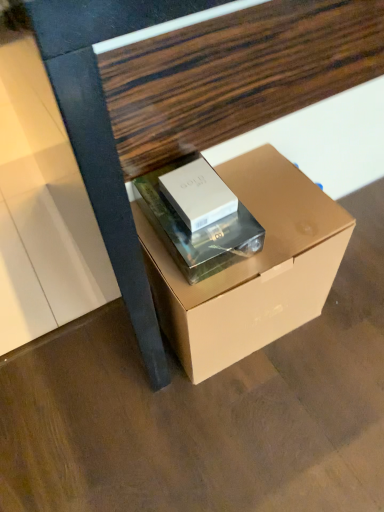
Describe the element at coordinates (187, 97) in the screenshot. I see `matte cardboard box at center` at that location.

Describe the element at coordinates (198, 230) in the screenshot. This screenshot has height=512, width=384. I see `matte white book at center` at that location.

Describe the element at coordinates (248, 267) in the screenshot. I see `matte cardboard box at center, arranged as the first box when viewed from the right` at that location.

In order to click on matte cardboard box at center in this screenshot , I will do `click(187, 97)`.

Between matte cardboard box at center, which appears as the 2th box when viewed from the left, and matte white book at center, which one is positioned in front?

matte cardboard box at center, which appears as the 2th box when viewed from the left, is in front.

Is matte cardboard box at center, which appears as the 2th box when viewed from the left, located outside matte white book at center?

Absolutely, matte cardboard box at center, which appears as the 2th box when viewed from the left, is external to matte white book at center.

Based on the photo, how different are the orientations of matte cardboard box at center, arranged as the first box when viewed from the right, and matte white book at center in degrees?

The facing directions of matte cardboard box at center, arranged as the first box when viewed from the right, and matte white book at center are 0.000742 degrees apart.

Is matte cardboard box at center, arranged as the first box when viewed from the right, at the right side of matte white book at center?

Yes, matte cardboard box at center, arranged as the first box when viewed from the right, is to the right of matte white book at center.

From a real-world perspective, between matte white book at center and matte cardboard box at center, arranged as the first box when viewed from the right, who is vertically lower?

In real-world perspective, matte cardboard box at center, arranged as the first box when viewed from the right, is lower.

From the image's perspective, between matte white book at center and matte cardboard box at center, which appears as the 2th box when viewed from the left, who is located below?

From the image's view, matte cardboard box at center, which appears as the 2th box when viewed from the left, is below.

Is matte white book at center outside of matte cardboard box at center, which appears as the 2th box when viewed from the left?

No, matte white book at center is inside or overlapping with matte cardboard box at center, which appears as the 2th box when viewed from the left.

Which is closer to the camera, (178, 167) or (290, 173)?

Positioned in front is point (178, 167).

From the image's perspective, which one is positioned lower, silver metallic box at center, which is the second box from right to left, or matte cardboard box at center?

silver metallic box at center, which is the second box from right to left.

You are a GUI agent. You are given a task and a screenshot of the screen. Output one action in this format:
    pyautogui.click(x=<x>, y=<y>)
    Task: Click on the furniture on the right of silver metallic box at center, which is the second box from right to left
    This screenshot has height=512, width=384.
    Given the screenshot: What is the action you would take?
    pyautogui.click(x=187, y=97)

Considering the relative sizes of silver metallic box at center, acting as the first box starting from the left, and matte cardboard box at center in the image provided, is silver metallic box at center, acting as the first box starting from the left, thinner than matte cardboard box at center?

Yes.

Can you confirm if silver metallic box at center, acting as the first box starting from the left, is shorter than matte cardboard box at center, which appears as the 2th box when viewed from the left?

Yes, silver metallic box at center, acting as the first box starting from the left, is shorter than matte cardboard box at center, which appears as the 2th box when viewed from the left.

Which point is more forward, (194, 208) or (251, 190)?

The point (194, 208) is more forward.

Considering the positions of objects silver metallic box at center, which is the second box from right to left, and matte cardboard box at center, arranged as the first box when viewed from the right, in the image provided, who is in front, silver metallic box at center, which is the second box from right to left, or matte cardboard box at center, arranged as the first box when viewed from the right,?

matte cardboard box at center, arranged as the first box when viewed from the right, is closer to the camera.

Would you say silver metallic box at center, which is the second box from right to left, is to the left or to the right of matte cardboard box at center, which appears as the 2th box when viewed from the left, in the picture?

In the image, silver metallic box at center, which is the second box from right to left, appears on the left side of matte cardboard box at center, which appears as the 2th box when viewed from the left.

Locate an element on the screen. box in front of the silver metallic box at center, acting as the first box starting from the left is located at coordinates (248, 267).

Choose the correct answer: Is matte cardboard box at center, arranged as the first box when viewed from the right, inside silver metallic box at center, acting as the first box starting from the left, or outside it?

The correct answer is: outside.

From a real-world perspective, relative to silver metallic box at center, acting as the first box starting from the left, is matte cardboard box at center, arranged as the first box when viewed from the right, vertically above or below?

Clearly, from a real-world perspective, matte cardboard box at center, arranged as the first box when viewed from the right, is below silver metallic box at center, acting as the first box starting from the left.

Is matte white book at center next to silver metallic box at center, which is the second box from right to left?

Yes, the surface of matte white book at center is in contact with silver metallic box at center, which is the second box from right to left.

Who is more distant, matte white book at center or silver metallic box at center, acting as the first box starting from the left?

silver metallic box at center, acting as the first box starting from the left.

Which of these two, matte white book at center or silver metallic box at center, which is the second box from right to left, is wider?

matte white book at center.

Based on their sizes in the image, would you say matte white book at center is bigger or smaller than silver metallic box at center, acting as the first box starting from the left?

Clearly, matte white book at center is larger in size than silver metallic box at center, acting as the first box starting from the left.

Can you see silver metallic box at center, which is the second box from right to left, touching matte white book at center?

Indeed, silver metallic box at center, which is the second box from right to left, and matte white book at center are beside each other and touching.

Looking at this image, is matte white book at center at the back of silver metallic box at center, acting as the first box starting from the left?

Correct, silver metallic box at center, acting as the first box starting from the left, is looking away from matte white book at center.

Looking at this image, in terms of width, does silver metallic box at center, acting as the first box starting from the left, look wider or thinner when compared to matte white book at center?

Clearly, silver metallic box at center, acting as the first box starting from the left, has less width compared to matte white book at center.

What's the angular difference between silver metallic box at center, which is the second box from right to left, and matte white book at center's facing directions?

There is a 0.00127-degree angle between the facing directions of silver metallic box at center, which is the second box from right to left, and matte white book at center.

What are the coordinates of `box below the matte white book at center (from the image's perspective)` in the screenshot? It's located at coord(248,267).

This screenshot has width=384, height=512. I want to click on paperback book behind the matte cardboard box at center, arranged as the first box when viewed from the right, so click(198, 230).

Which object lies further to the anchor point matte white book at center, matte cardboard box at center, arranged as the first box when viewed from the right, or matte cardboard box at center?

matte cardboard box at center.

From the image, which object appears to be farther from silver metallic box at center, which is the second box from right to left, matte cardboard box at center or matte white book at center?

matte cardboard box at center.

Estimate the real-world distances between objects in this image. Which object is further from matte white book at center, matte cardboard box at center or matte cardboard box at center, arranged as the first box when viewed from the right?

The object further to matte white book at center is matte cardboard box at center.

Looking at the image, which one is located further to silver metallic box at center, which is the second box from right to left, matte white book at center or matte cardboard box at center, which appears as the 2th box when viewed from the left?

matte cardboard box at center, which appears as the 2th box when viewed from the left, is positioned further to the anchor silver metallic box at center, which is the second box from right to left.

In the scene shown: Considering their positions, is matte cardboard box at center, which appears as the 2th box when viewed from the left, positioned closer to matte white book at center than silver metallic box at center, acting as the first box starting from the left?

Based on the image, silver metallic box at center, acting as the first box starting from the left, appears to be nearer to matte white book at center.

Estimate the real-world distances between objects in this image. Which object is closer to matte cardboard box at center, matte cardboard box at center, which appears as the 2th box when viewed from the left, or silver metallic box at center, acting as the first box starting from the left?

silver metallic box at center, acting as the first box starting from the left, is positioned closer to the anchor matte cardboard box at center.

Which object lies further to the anchor point matte cardboard box at center, which appears as the 2th box when viewed from the left, silver metallic box at center, acting as the first box starting from the left, or matte cardboard box at center?

matte cardboard box at center is further to matte cardboard box at center, which appears as the 2th box when viewed from the left.

Estimate the real-world distances between objects in this image. Which object is further from matte cardboard box at center, silver metallic box at center, acting as the first box starting from the left, or matte cardboard box at center, which appears as the 2th box when viewed from the left?

matte cardboard box at center, which appears as the 2th box when viewed from the left, lies further to matte cardboard box at center than the other object.

Find the location of a particular element. The height and width of the screenshot is (512, 384). paperback book between silver metallic box at center, which is the second box from right to left, and matte cardboard box at center, arranged as the first box when viewed from the right, vertically is located at coordinates (198, 230).

I want to click on box between matte cardboard box at center and matte cardboard box at center, which appears as the 2th box when viewed from the left, in the vertical direction, so click(198, 194).

Locate an element on the screen. paperback book that lies between matte cardboard box at center and matte cardboard box at center, arranged as the first box when viewed from the right, from top to bottom is located at coordinates (198, 230).

Locate an element on the screen. The height and width of the screenshot is (512, 384). box between matte cardboard box at center and matte white book at center vertically is located at coordinates (198, 194).